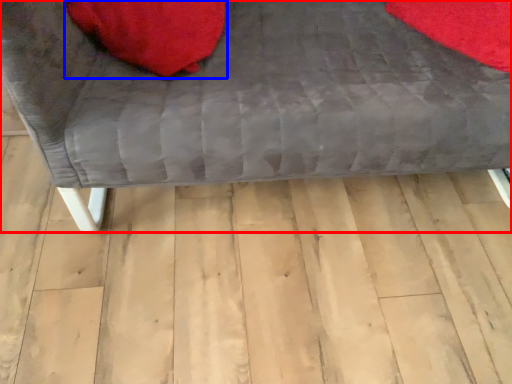
Question: Which of the following is the closest to the observer, furniture (highlighted by a red box) or bean bag chair (highlighted by a blue box)?

Choices:
 (A) furniture
 (B) bean bag chair

Answer: (A)